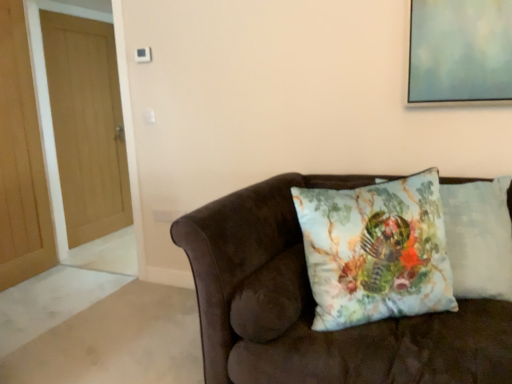
Question: Looking at the image, does velvet brown couch at center seem bigger or smaller compared to floral cotton cushion at center, arranged as the 1th pillow when viewed from the left?

Choices:
 (A) big
 (B) small

Answer: (A)

Question: Is velvet brown couch at center wider or thinner than floral cotton cushion at center, positioned as the 2th pillow in right-to-left order?

Choices:
 (A) wide
 (B) thin

Answer: (A)

Question: Based on their relative distances, which object is farther from the wooden door at left, which is the second door from front to back?

Choices:
 (A) floral cotton cushion at center, arranged as the 1th pillow when viewed from the left
 (B) floral fabric cushion at right, which is the 1th pillow from right to left
 (C) velvet brown couch at center
 (D) light brown wood door at left, arranged as the 1th door when viewed from the front

Answer: (B)

Question: Which object is the farthest from the light brown wood door at left, arranged as the 1th door when viewed from the front?

Choices:
 (A) wooden door at left, which is the second door from front to back
 (B) floral cotton cushion at center, arranged as the 1th pillow when viewed from the left
 (C) velvet brown couch at center
 (D) floral fabric cushion at right, which is the 1th pillow from right to left

Answer: (D)